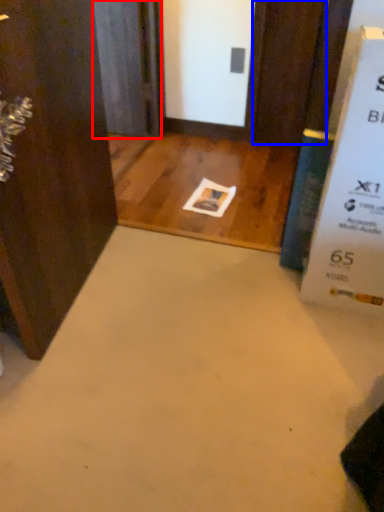
Question: Which object appears farthest to the camera in this image, screen door (highlighted by a red box) or door (highlighted by a blue box)?

Choices:
 (A) screen door
 (B) door

Answer: (A)